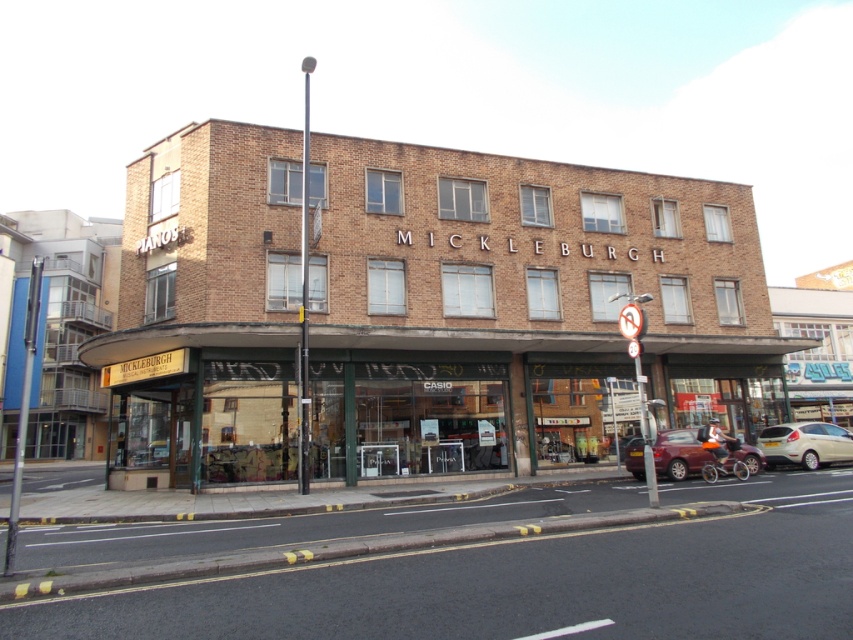
Is brown brick building at center above white matte car at lower right?

A: Yes.

Who is more forward, (x=285, y=282) or (x=817, y=429)?

Positioned in front is point (x=285, y=282).

Find the location of a particular element. This screenshot has width=853, height=640. brown brick building at center is located at coordinates (520, 308).

Where is `brown brick building at center`? This screenshot has height=640, width=853. brown brick building at center is located at coordinates (520, 308).

Between matte red car at lower right and white matte car at lower right, which one is positioned higher?

Positioned higher is matte red car at lower right.

Between point (665, 464) and point (846, 449), which one is positioned in front?

Point (665, 464)

Is point (634, 449) more distant than point (840, 454)?

No.

Where is `matte red car at lower right`? The image size is (853, 640). matte red car at lower right is located at coordinates (677, 452).

Identify the location of brown brick building at center. This screenshot has width=853, height=640. (520, 308).

Which is in front, point (337, 259) or point (630, 458)?

Point (630, 458) is more forward.

Locate an element on the screen. The image size is (853, 640). brown brick building at center is located at coordinates click(520, 308).